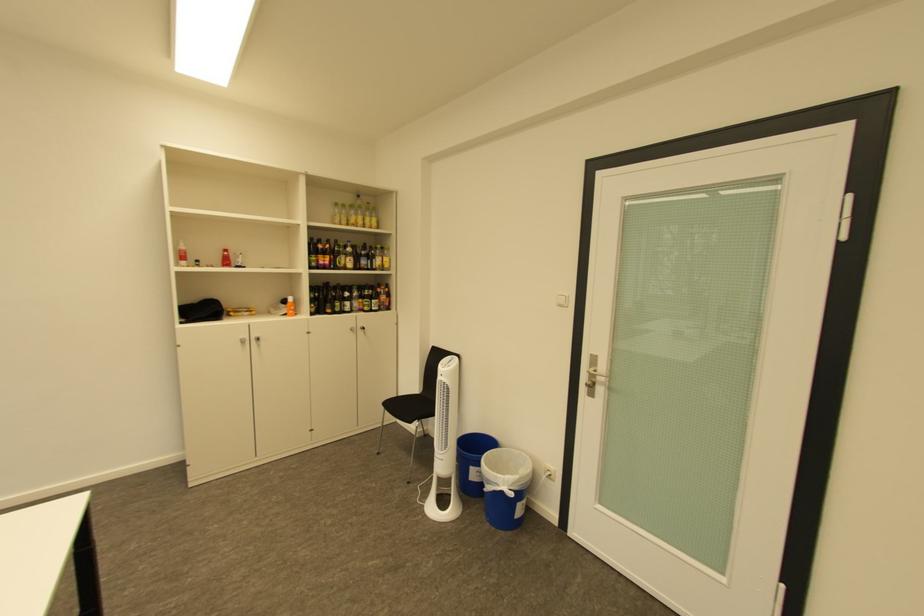
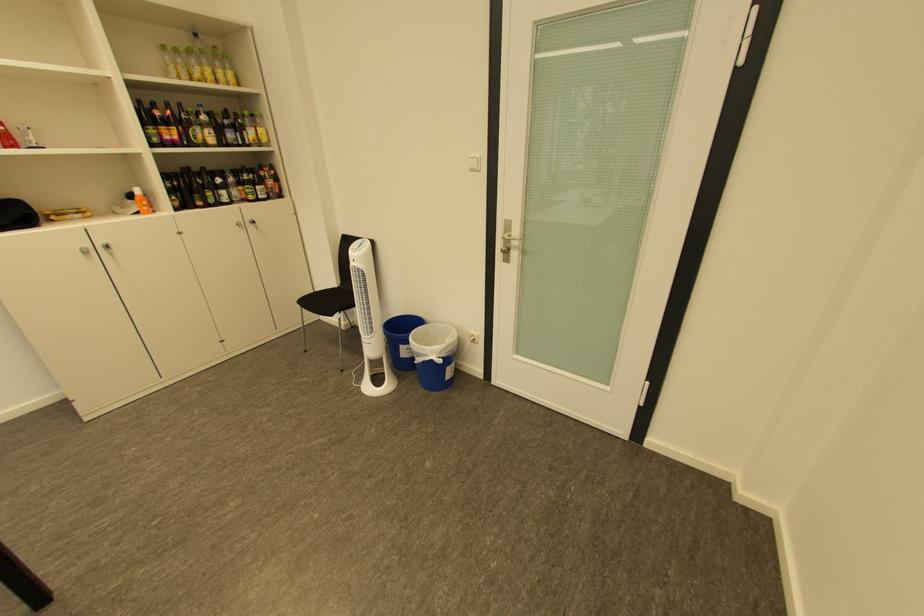
In the second image, find the point that corresponds to point 499,483 in the first image.

(429, 355)